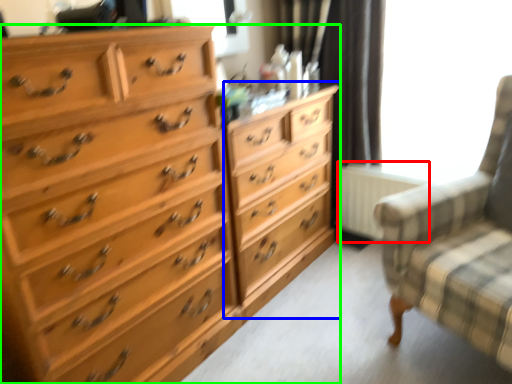
Question: Considering the real-world distances, which object is closest to radiator (highlighted by a red box)? dresser (highlighted by a blue box) or chest of drawers (highlighted by a green box).

Choices:
 (A) dresser
 (B) chest of drawers

Answer: (A)